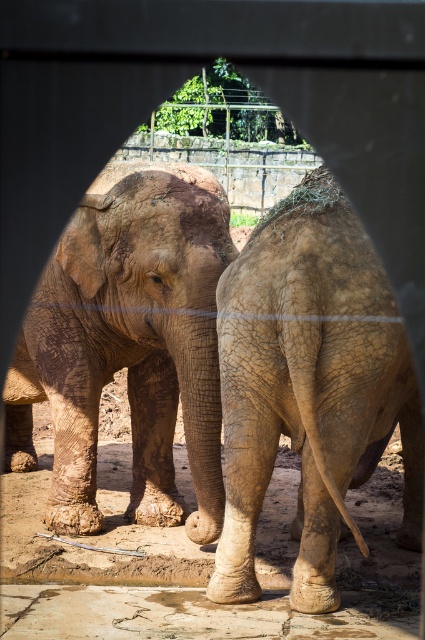
Question: Which point is closer to the camera taking this photo?

Choices:
 (A) coord(226,323)
 (B) coord(164,168)

Answer: (A)

Question: Can you confirm if muddy textured elephant at center is wider than brown textured skin at center?

Choices:
 (A) no
 (B) yes

Answer: (B)

Question: Among these points, which one is farthest from the camera?

Choices:
 (A) (223, 579)
 (B) (175, 209)

Answer: (B)

Question: Observing the image, what is the correct spatial positioning of muddy textured elephant at center in reference to brown textured skin at center?

Choices:
 (A) right
 (B) left

Answer: (B)

Question: Can you confirm if muddy textured elephant at center is positioned to the left of brown textured skin at center?

Choices:
 (A) yes
 (B) no

Answer: (A)